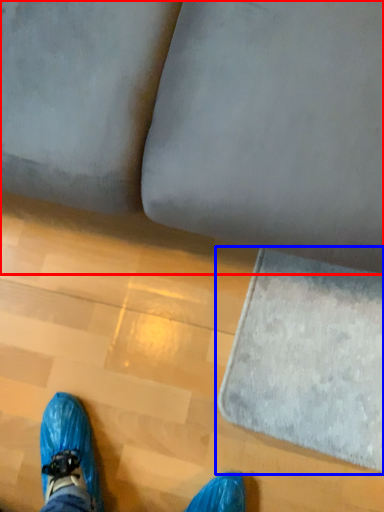
Question: Among these objects, which one is farthest to the camera, studio couch (highlighted by a red box) or mat (highlighted by a blue box)?

Choices:
 (A) studio couch
 (B) mat

Answer: (B)